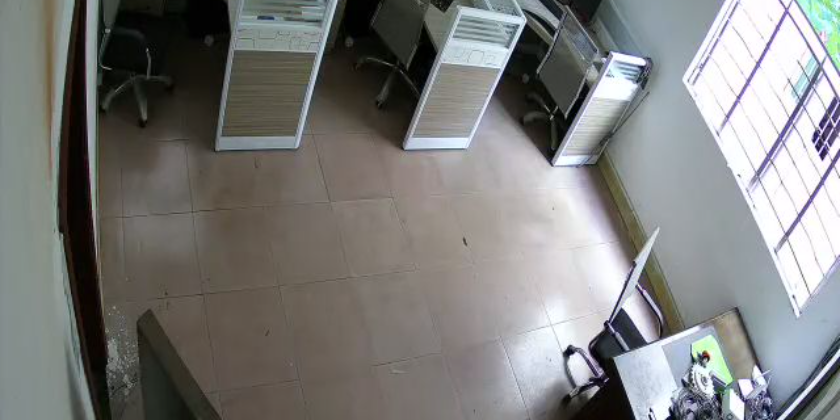
What are the coordinates of `baseboard` in the screenshot? It's located at (627, 220).